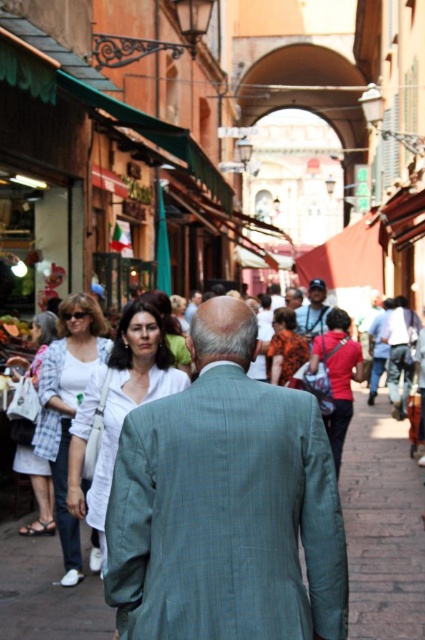
Question: Does green plaid suit at center appear under white cotton shirt at left?

Choices:
 (A) no
 (B) yes

Answer: (A)

Question: Is orange floral dress at center to the left of smooth white blouse at center from the viewer's perspective?

Choices:
 (A) yes
 (B) no

Answer: (B)

Question: Which object is positioned closest to the matte red shirt at center?

Choices:
 (A) white cotton shirt at left
 (B) orange floral dress at center
 (C) smooth white blouse at center
 (D) matte blue cap at center

Answer: (B)

Question: Is the position of green plaid suit at center less distant than that of orange floral dress at center?

Choices:
 (A) yes
 (B) no

Answer: (A)

Question: Which is nearer to the green plaid suit at center?

Choices:
 (A) smooth white blouse at center
 (B) white matte shirt at center
 (C) orange floral dress at center

Answer: (B)

Question: Which of these objects is positioned closest to the matte blue cap at center?

Choices:
 (A) white matte shirt at center
 (B) orange floral dress at center
 (C) smooth white blouse at center

Answer: (B)